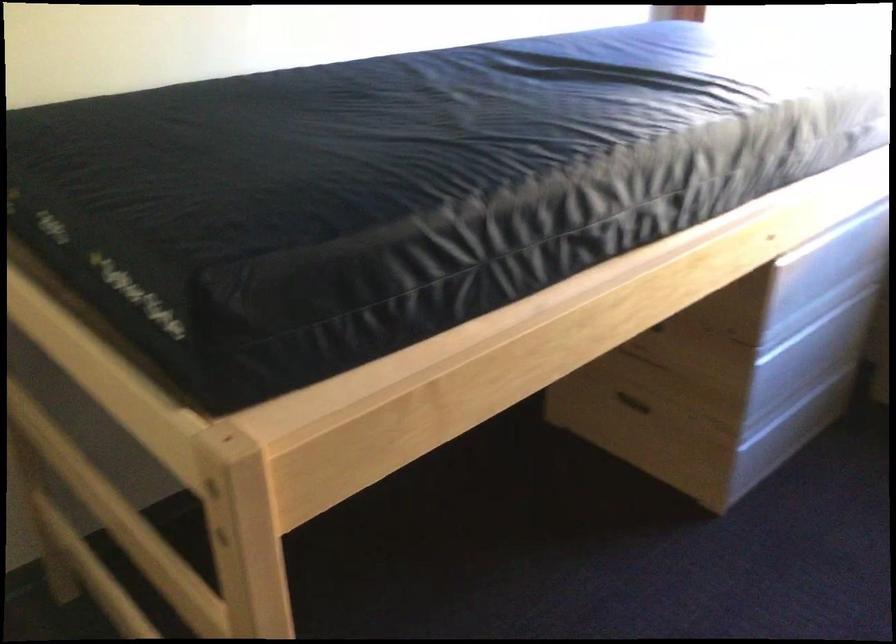
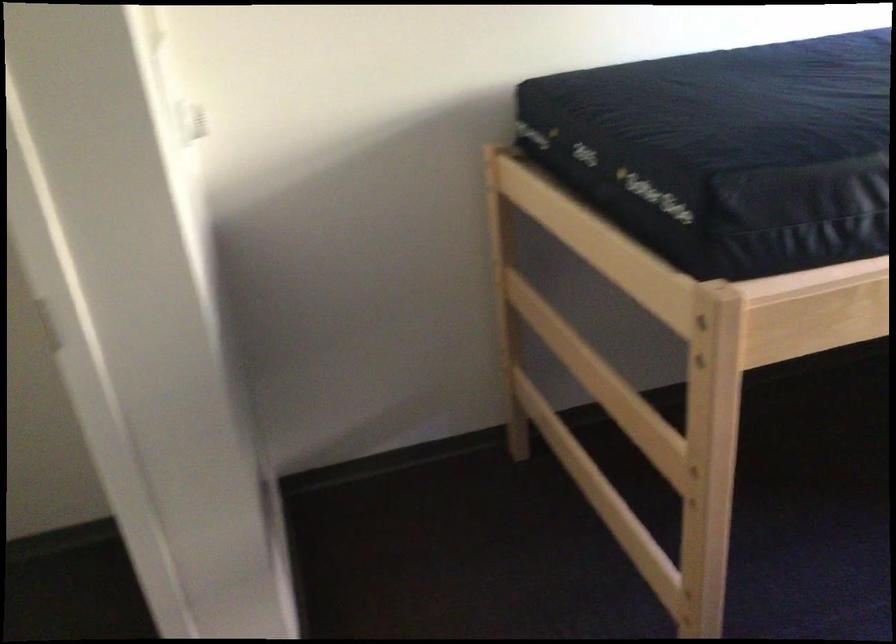
Locate, in the second image, the point that corresponds to point 266,166 in the first image.

(753, 108)